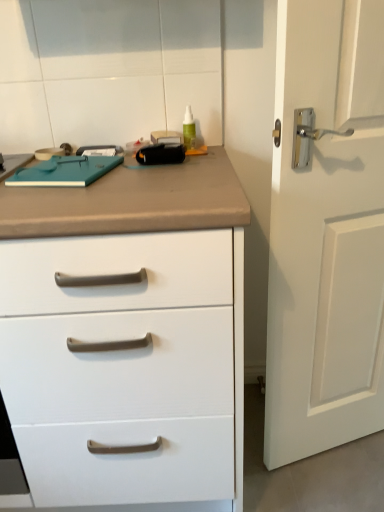
Question: Is white matte door at right beside white matte chest of drawers at center?

Choices:
 (A) no
 (B) yes

Answer: (A)

Question: Considering the relative positions of white matte door at right and white matte chest of drawers at center in the image provided, is white matte door at right to the right of white matte chest of drawers at center from the viewer's perspective?

Choices:
 (A) no
 (B) yes

Answer: (B)

Question: Is white matte door at right oriented towards white matte chest of drawers at center?

Choices:
 (A) yes
 (B) no

Answer: (B)

Question: Is white matte door at right looking in the opposite direction of white matte chest of drawers at center?

Choices:
 (A) yes
 (B) no

Answer: (B)

Question: Is the position of white matte door at right more distant than that of white matte chest of drawers at center?

Choices:
 (A) no
 (B) yes

Answer: (B)

Question: Can white matte chest of drawers at center be found inside white matte door at right?

Choices:
 (A) yes
 (B) no

Answer: (B)

Question: Does white matte chest of drawers at center have a greater width compared to white matte door at right?

Choices:
 (A) no
 (B) yes

Answer: (B)

Question: Is white matte chest of drawers at center positioned behind white matte door at right?

Choices:
 (A) no
 (B) yes

Answer: (A)

Question: Is white matte door at right located within white matte chest of drawers at center?

Choices:
 (A) yes
 (B) no

Answer: (B)

Question: From the image's perspective, is white matte chest of drawers at center beneath white matte door at right?

Choices:
 (A) yes
 (B) no

Answer: (A)

Question: From a real-world perspective, is white matte chest of drawers at center physically above white matte door at right?

Choices:
 (A) no
 (B) yes

Answer: (A)

Question: From a real-world perspective, is white matte chest of drawers at center below white matte door at right?

Choices:
 (A) yes
 (B) no

Answer: (A)

Question: Choose the correct answer: Is white matte chest of drawers at center inside white matte door at right or outside it?

Choices:
 (A) inside
 (B) outside

Answer: (B)